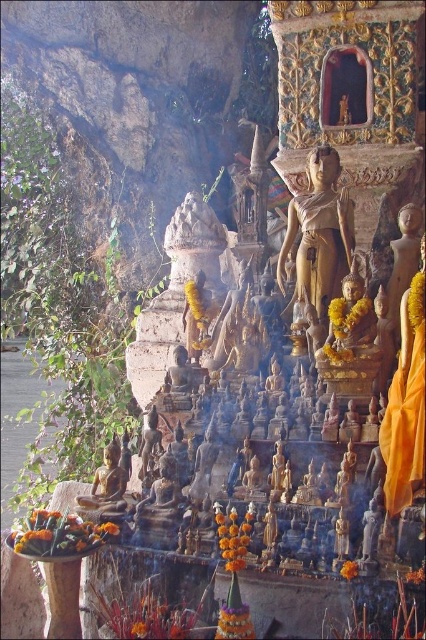
Locate an element on the screen. gold polished statue at center is located at coordinates (319, 234).

In the scene shown: Can you confirm if gold polished statue at center is positioned to the right of bronze statue at lower left?

Correct, you'll find gold polished statue at center to the right of bronze statue at lower left.

Between point (319, 186) and point (106, 502), which one is positioned behind?

The point (319, 186) is behind.

Locate an element on the screen. gold polished statue at center is located at coordinates (319, 234).